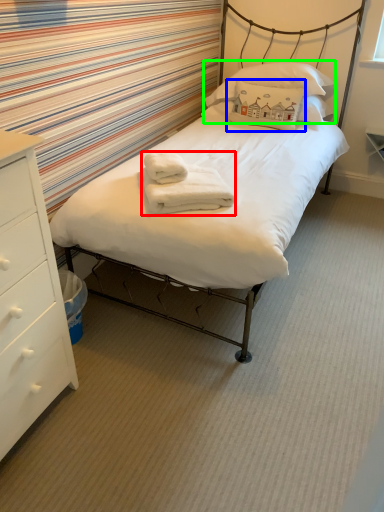
Question: Based on their relative distances, which object is nearer to bath towel (highlighted by a red box)? Choose from pillow (highlighted by a blue box) and pillow (highlighted by a green box).

Choices:
 (A) pillow
 (B) pillow

Answer: (A)